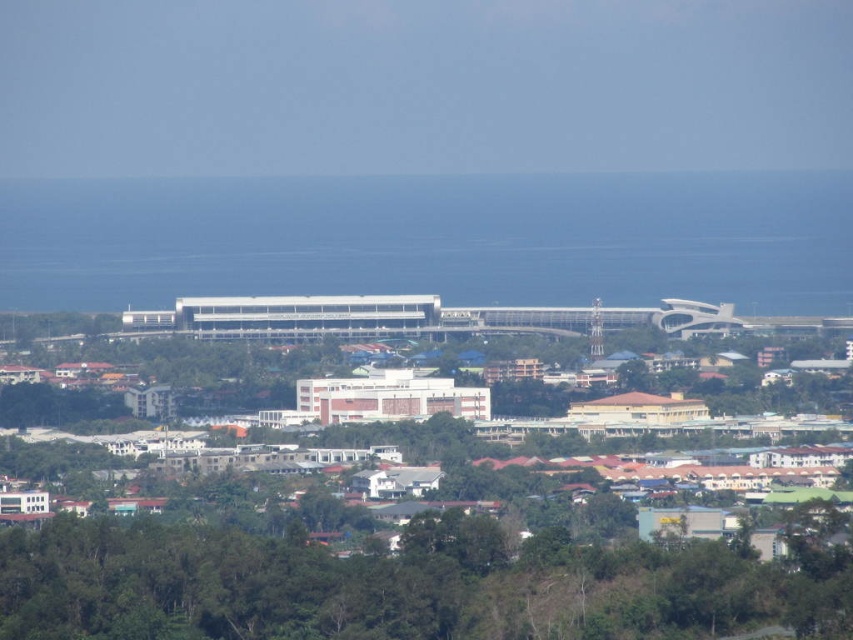
Between transparent glass water at center and green leafy trees at lower center, which one appears on the right side from the viewer's perspective?

transparent glass water at center

Is point (554, 278) farther from viewer compared to point (575, 636)?

No, (554, 278) is closer to viewer.

Is point (178, 288) less distant than point (15, 614)?

Yes, it is in front of point (15, 614).

Locate an element on the screen. This screenshot has width=853, height=640. transparent glass water at center is located at coordinates (433, 240).